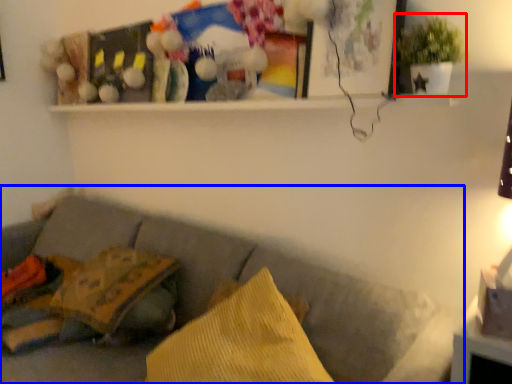
Question: Which object appears farthest to the camera in this image, houseplant (highlighted by a red box) or studio couch (highlighted by a blue box)?

Choices:
 (A) houseplant
 (B) studio couch

Answer: (A)